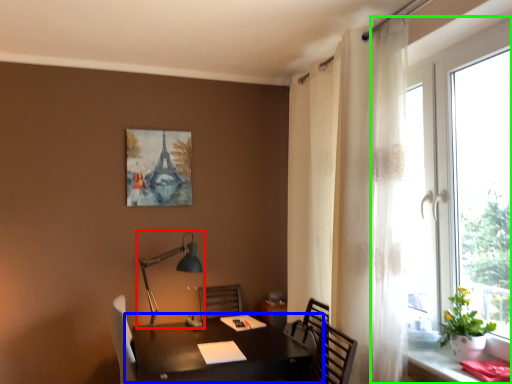
Question: Which object is the farthest from table lamp (highlighted by a red box)? Choose among these: table (highlighted by a blue box) or window (highlighted by a green box).

Choices:
 (A) table
 (B) window

Answer: (B)